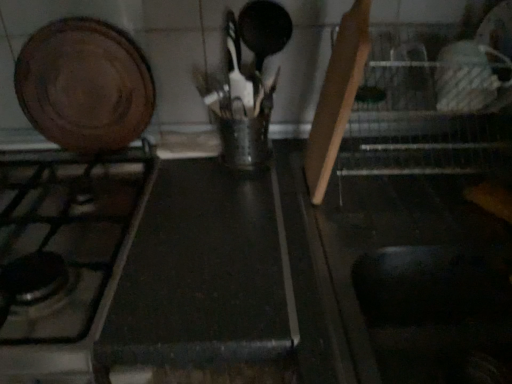
Question: Would you say black matte counter top at center is inside or outside wooden cutting board at upper left?

Choices:
 (A) inside
 (B) outside

Answer: (B)

Question: In the image, is black matte counter top at center on the left side or the right side of wooden cutting board at upper left?

Choices:
 (A) right
 (B) left

Answer: (A)

Question: Which object is the closest to the black matte counter top at center?

Choices:
 (A) matte black gas stove at left
 (B) wooden cutting board at upper left

Answer: (A)

Question: Which of these objects is positioned farthest from the black matte counter top at center?

Choices:
 (A) matte black gas stove at left
 (B) wooden cutting board at upper left

Answer: (B)